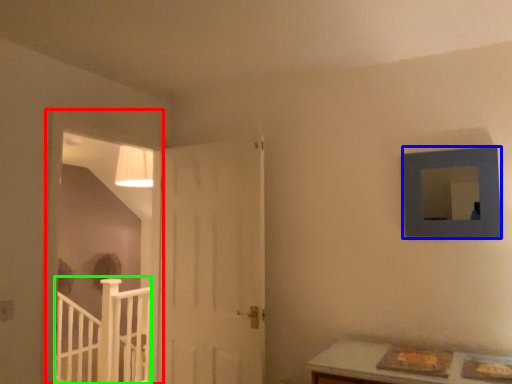
Question: Considering the real-world distances, which object is closest to window frame (highlighted by a red box)? picture frame (highlighted by a blue box) or rail (highlighted by a green box).

Choices:
 (A) picture frame
 (B) rail

Answer: (B)